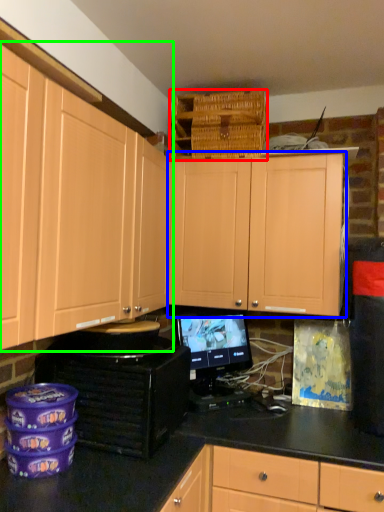
Question: Which object is positioned farthest from basket (highlighted by a red box)? Select from cabinetry (highlighted by a blue box) and cabinetry (highlighted by a green box).

Choices:
 (A) cabinetry
 (B) cabinetry

Answer: (B)